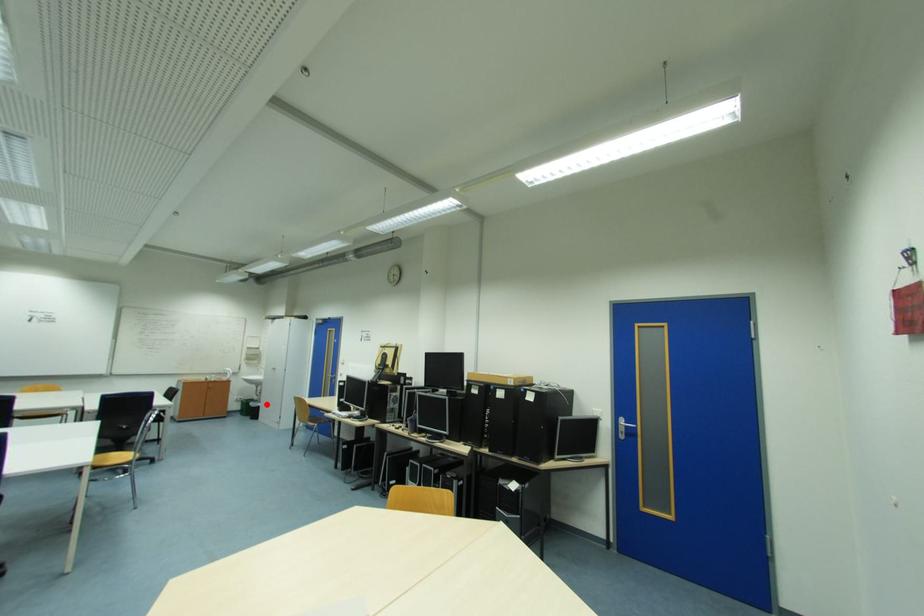
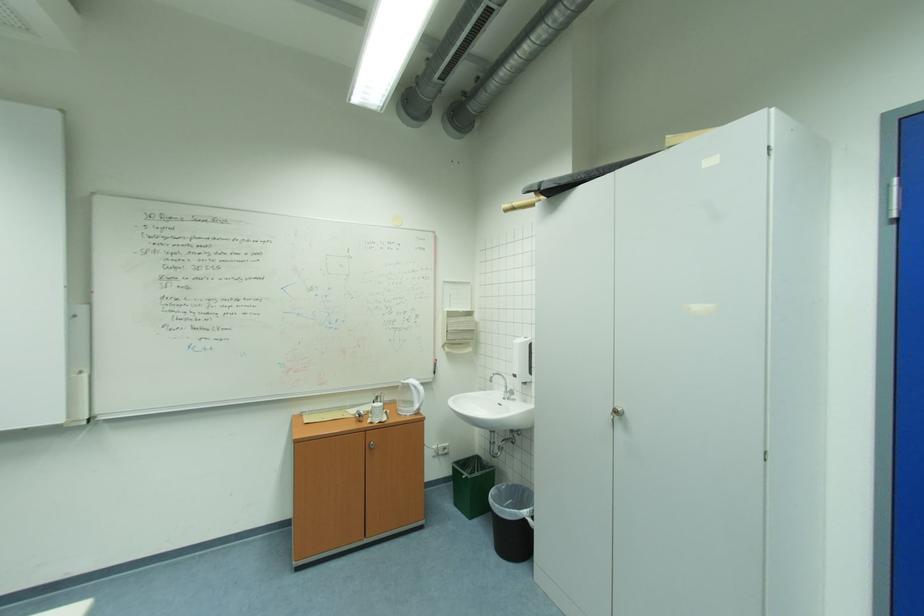
Question: A red point is marked in image1. In image2, is the corresponding 3D point closer to the camera or farther? Reply with the corresponding letter.

Choices:
 (A) The corresponding 3D point is closer.
 (B) The corresponding 3D point is farther.

Answer: (A)